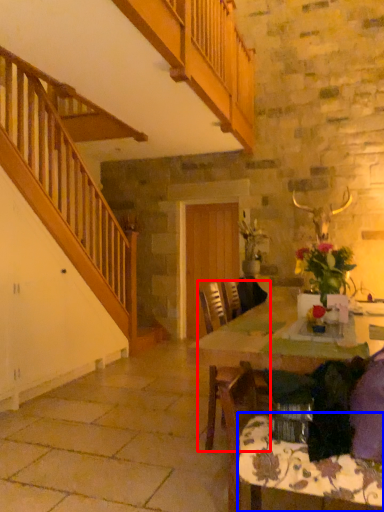
Question: Which object is closer to the camera taking this photo, chair (highlighted by a red box) or tablecloth (highlighted by a blue box)?

Choices:
 (A) chair
 (B) tablecloth

Answer: (B)